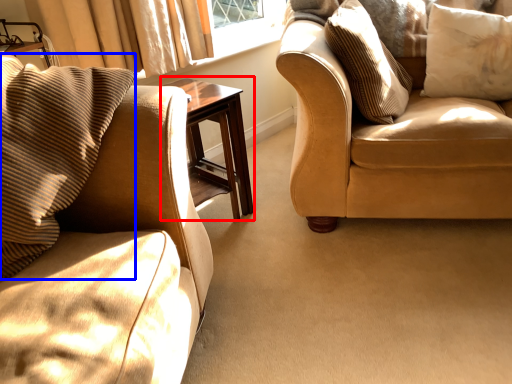
Question: Among these objects, which one is nearest to the camera, table (highlighted by a red box) or pillow (highlighted by a blue box)?

Choices:
 (A) table
 (B) pillow

Answer: (B)